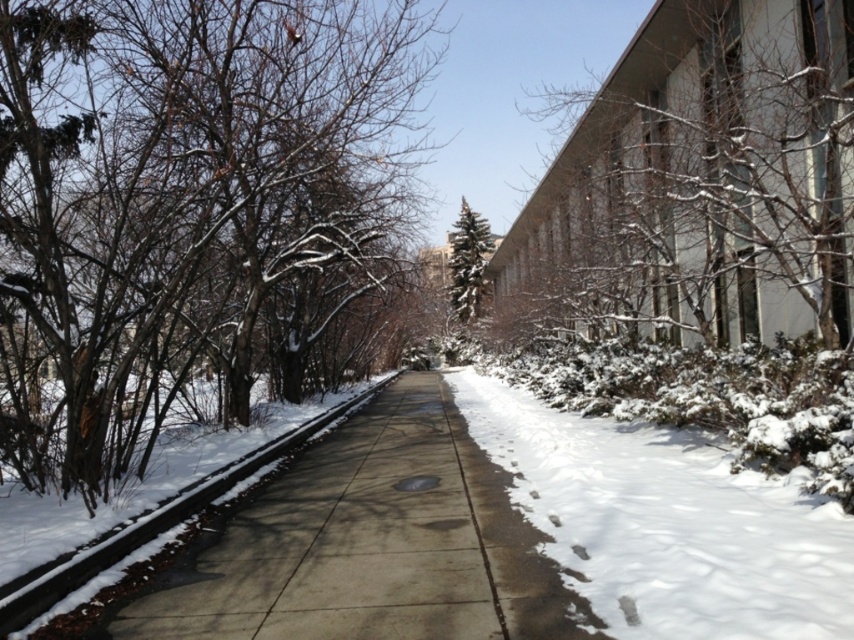
Question: Considering the relative positions of snow-covered branches at left and green textured evergreen tree at center in the image provided, where is snow-covered branches at left located with respect to green textured evergreen tree at center?

Choices:
 (A) right
 (B) left

Answer: (B)

Question: Which of these objects is positioned closest to the snow-covered branches at left?

Choices:
 (A) green textured evergreen tree at center
 (B) snow-covered branches at upper right

Answer: (B)

Question: In this image, where is snow-covered branches at upper right located relative to green textured evergreen tree at center?

Choices:
 (A) above
 (B) below

Answer: (B)

Question: Considering the real-world distances, which object is closest to the concrete at center?

Choices:
 (A) green textured evergreen tree at center
 (B) snow-covered branches at upper right
 (C) snow-covered branches at left
 (D) white fluffy snow at center

Answer: (C)

Question: Is white fluffy snow at center wider than green textured evergreen tree at center?

Choices:
 (A) yes
 (B) no

Answer: (B)

Question: Among these points, which one is farthest from the camera?

Choices:
 (A) 183,118
 (B) 389,376
 (C) 589,472

Answer: (B)